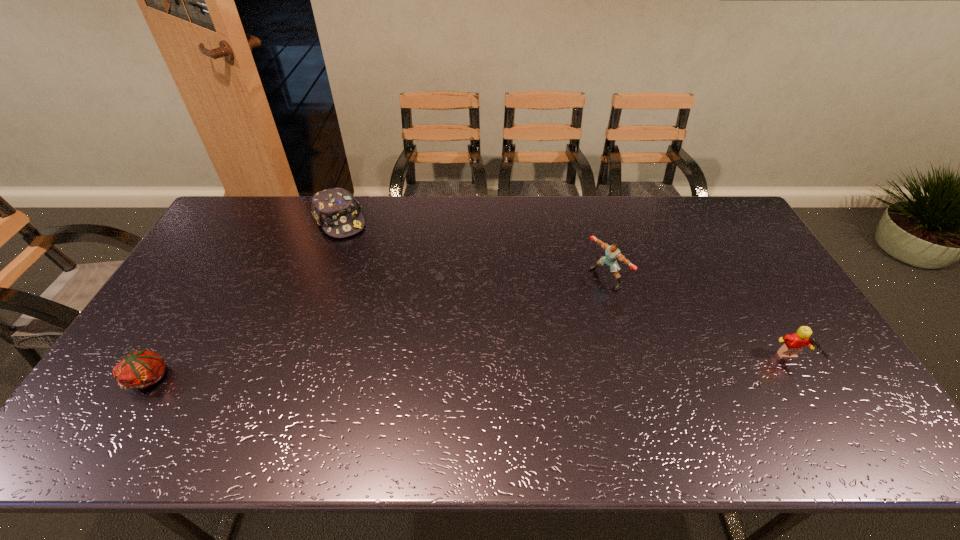
Where is `vacant space on the desktop that is between the leftmost object and the rightmost object and is positioned on the front-facing side of the second farthest object`? vacant space on the desktop that is between the leftmost object and the rightmost object and is positioned on the front-facing side of the second farthest object is located at coordinates click(x=447, y=370).

Find the location of a particular element. This screenshot has width=960, height=540. free space on the desktop that is between the tomato and the rightmost object and is positioned on the front-facing side of the headwear is located at coordinates (447, 370).